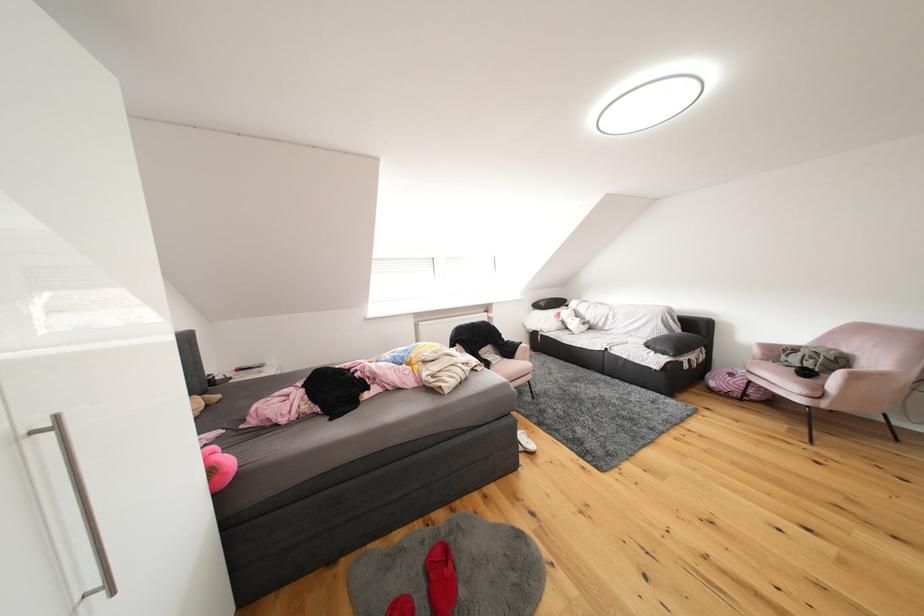
Describe the element at coordinates (768, 350) in the screenshot. I see `the sofa armrest` at that location.